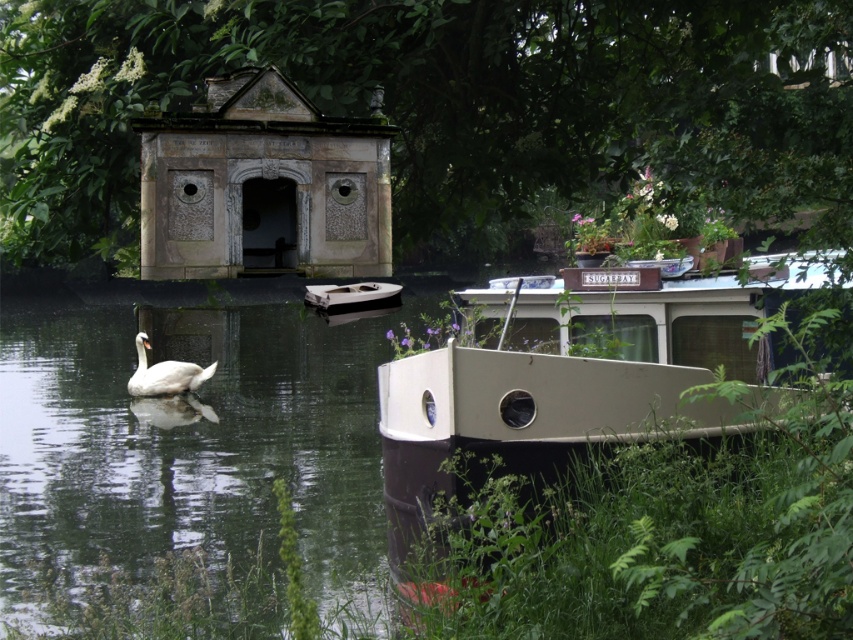
Question: Which object is positioned closest to the smooth brown boat at lower right?

Choices:
 (A) white glossy boat at center
 (B) white glossy swan at center
 (C) matte white boat at center

Answer: (B)

Question: Can you confirm if smooth brown boat at lower right is positioned to the left of white glossy swan at center?

Choices:
 (A) no
 (B) yes

Answer: (A)

Question: Among these objects, which one is farthest from the camera?

Choices:
 (A) white glossy swan at center
 (B) white glossy boat at center
 (C) smooth brown boat at lower right
 (D) matte white boat at center

Answer: (A)

Question: Is the position of smooth brown boat at lower right more distant than that of matte white boat at center?

Choices:
 (A) no
 (B) yes

Answer: (A)

Question: Is white glossy swan at center thinner than white glossy boat at center?

Choices:
 (A) no
 (B) yes

Answer: (A)

Question: Which of the following is the closest to the observer?

Choices:
 (A) smooth brown boat at lower right
 (B) white glossy swan at center
 (C) matte white boat at center

Answer: (A)